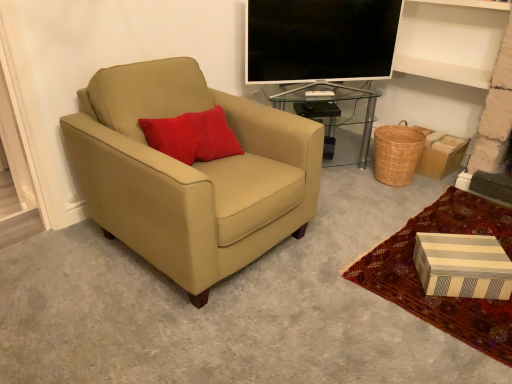
Question: Looking at the image, does flat screen tv at upper center seem bigger or smaller compared to woven brown basket at lower right?

Choices:
 (A) big
 (B) small

Answer: (A)

Question: From the image's perspective, is flat screen tv at upper center located above or below woven brown basket at lower right?

Choices:
 (A) below
 (B) above

Answer: (B)

Question: Considering the real-world distances, which object is farthest from the striped cardboard box at lower right?

Choices:
 (A) flat screen tv at upper center
 (B) woven brown basket at lower right
 (C) transparent glass table at center
 (D) striped cardboard box at lower right
 (E) beige leather armchair at left

Answer: (A)

Question: Which object is the farthest from the striped cardboard box at lower right?

Choices:
 (A) striped cardboard box at lower right
 (B) woven brown basket at lower right
 (C) beige leather armchair at left
 (D) transparent glass table at center
 (E) flat screen tv at upper center

Answer: (E)